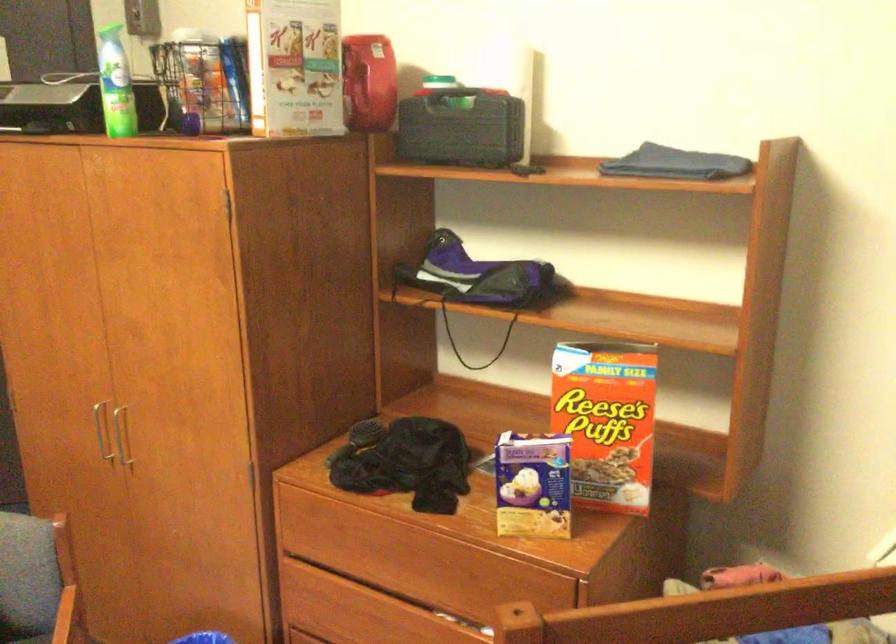
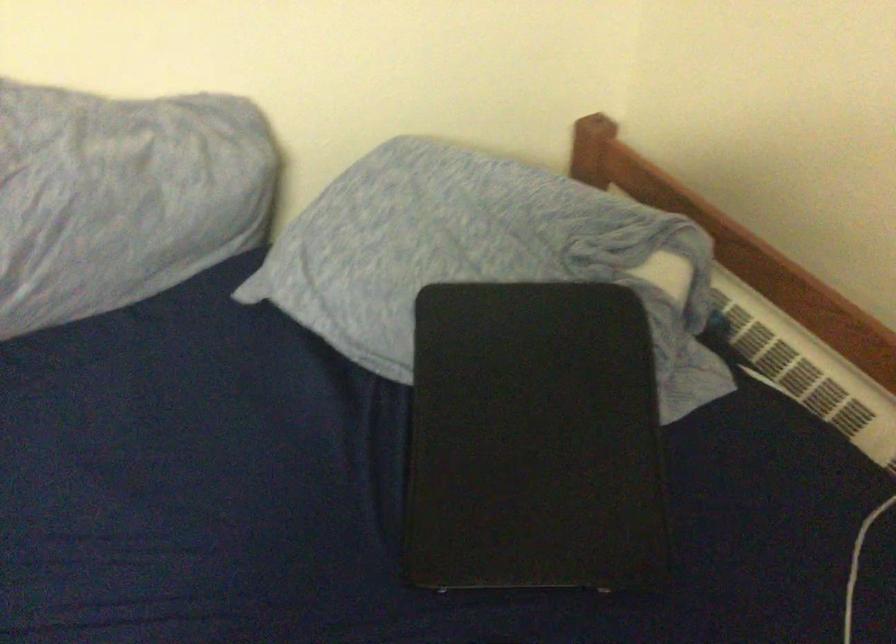
How did the camera likely rotate?

The camera's rotation is toward right-down.